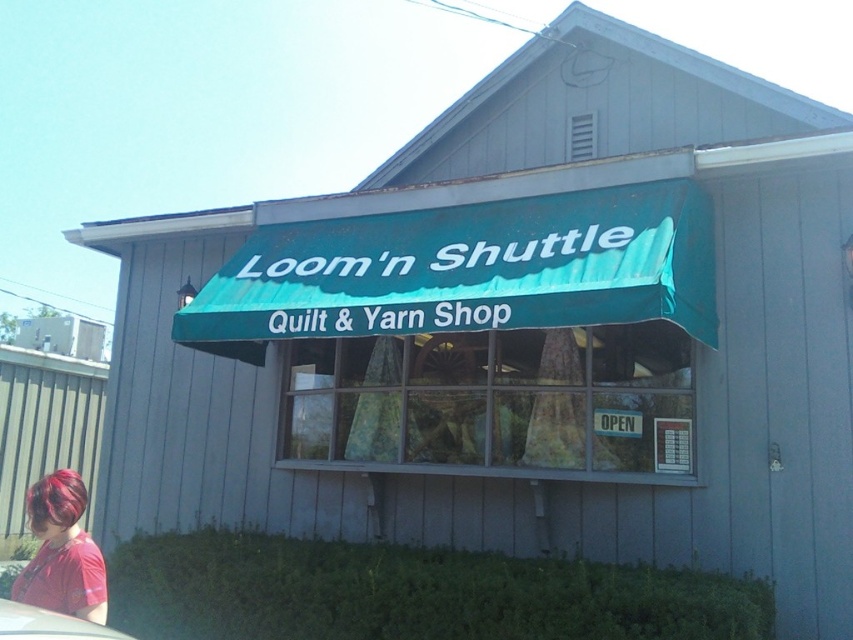
Is teal fabric awning at center shorter than shiny red hair at lower left?

No, teal fabric awning at center is not shorter than shiny red hair at lower left.

The width and height of the screenshot is (853, 640). I want to click on teal fabric awning at center, so click(467, 269).

The height and width of the screenshot is (640, 853). I want to click on teal fabric awning at center, so click(x=467, y=269).